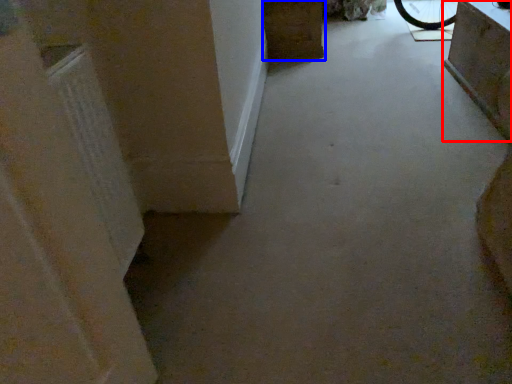
Question: Among these objects, which one is farthest to the camera, furniture (highlighted by a red box) or furniture (highlighted by a blue box)?

Choices:
 (A) furniture
 (B) furniture

Answer: (B)